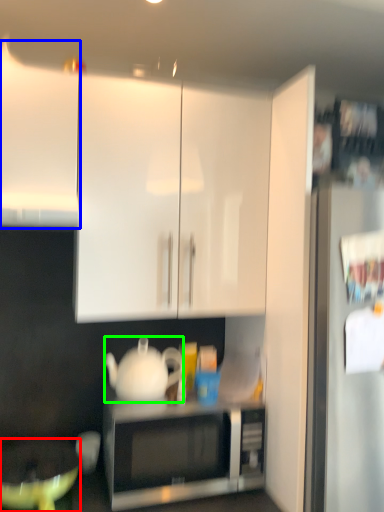
Question: Estimate the real-world distances between objects in this image. Which object is farther from mixing bowl (highlighted by a red box), cabinetry (highlighted by a blue box) or teapot (highlighted by a green box)?

Choices:
 (A) cabinetry
 (B) teapot

Answer: (A)